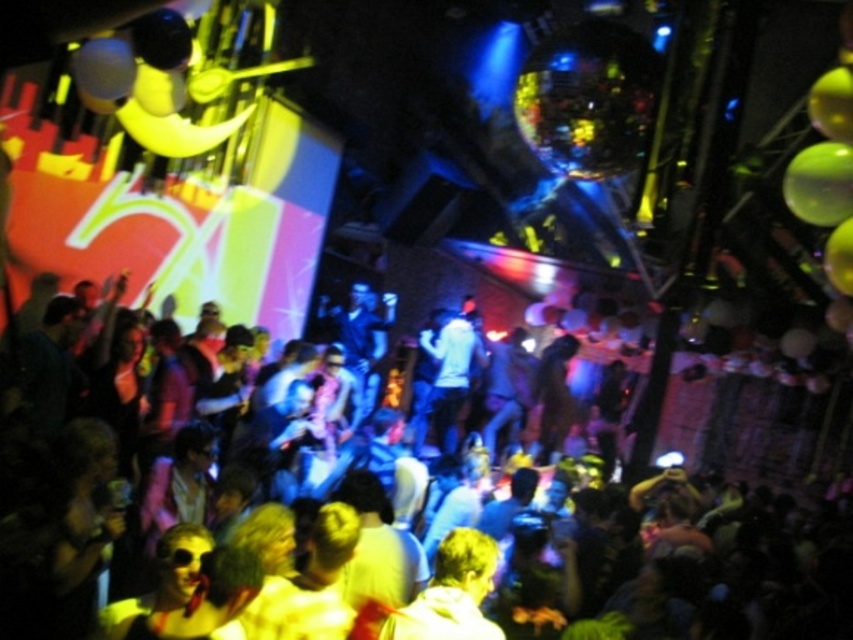
Is white matte shirt at center below green rubber balloon at upper right?

Yes.

Who is more distant from viewer, (x=450, y=426) or (x=796, y=156)?

Point (x=450, y=426)

At what (x,y) coordinates should I click in order to perform the action: click on white matte shirt at center. Please return your answer as a coordinate pair (x, y). This screenshot has width=853, height=640. Looking at the image, I should click on (447, 376).

At what (x,y) coordinates should I click in order to perform the action: click on white matte shirt at center. Please return your answer as a coordinate pair (x, y). Looking at the image, I should click on (447, 376).

Can you confirm if shiny plastic balloons at center is bigger than white matte shirt at center?

No.

In the scene shown: Measure the distance between point (401, 554) and camera.

Point (401, 554) and camera are 4.09 meters apart.

Which is in front, point (666, 483) or point (450, 358)?

Positioned in front is point (666, 483).

Locate an element on the screen. The width and height of the screenshot is (853, 640). shiny plastic balloons at center is located at coordinates (720, 561).

Who is positioned more to the right, shiny plastic balloons at center or green rubber balloon at upper right?

shiny plastic balloons at center

What do you see at coordinates (720, 561) in the screenshot? I see `shiny plastic balloons at center` at bounding box center [720, 561].

Which is in front, point (165, 525) or point (796, 211)?

Point (796, 211) is in front.

Find the location of `shiny plastic balloons at center`. shiny plastic balloons at center is located at coordinates (720, 561).